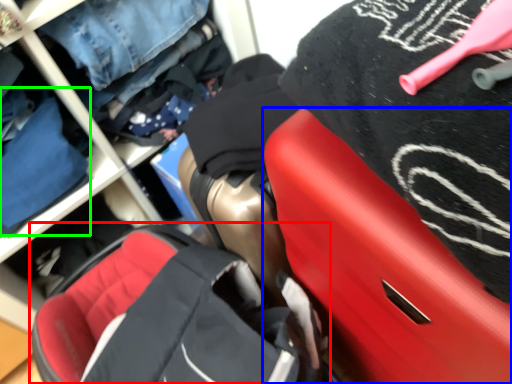
Question: Which object is positioned farthest from baby carriage (highlighted by a red box)? Select from luggage (highlighted by a blue box) and clothing (highlighted by a green box).

Choices:
 (A) luggage
 (B) clothing

Answer: (B)